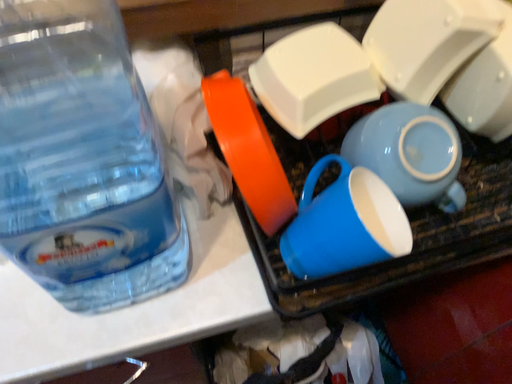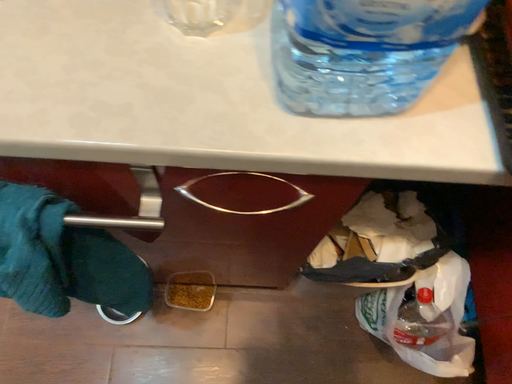
Question: How did the camera likely rotate when shooting the video?

Choices:
 (A) rotated left
 (B) rotated right

Answer: (A)